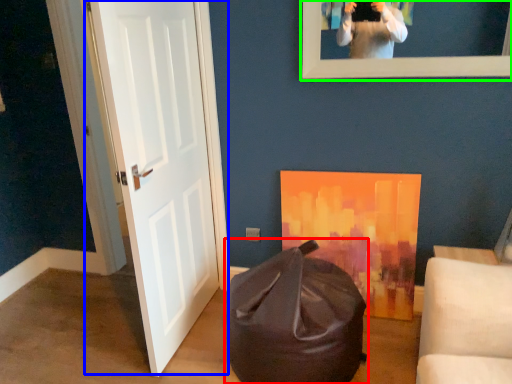
Question: Which is farther away from bean bag chair (highlighted by a red box)? door (highlighted by a blue box) or picture frame (highlighted by a green box)?

Choices:
 (A) door
 (B) picture frame

Answer: (B)